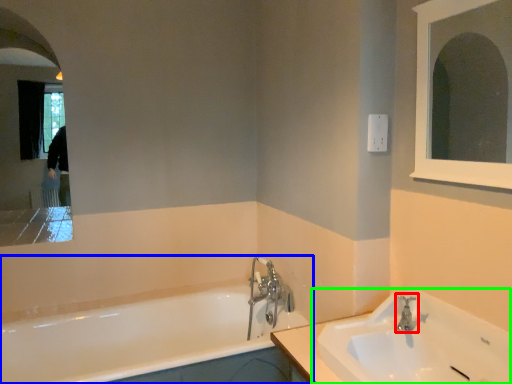
Question: Which is nearer to the tap (highlighted by a red box)? bathtub (highlighted by a blue box) or sink (highlighted by a green box).

Choices:
 (A) bathtub
 (B) sink

Answer: (B)